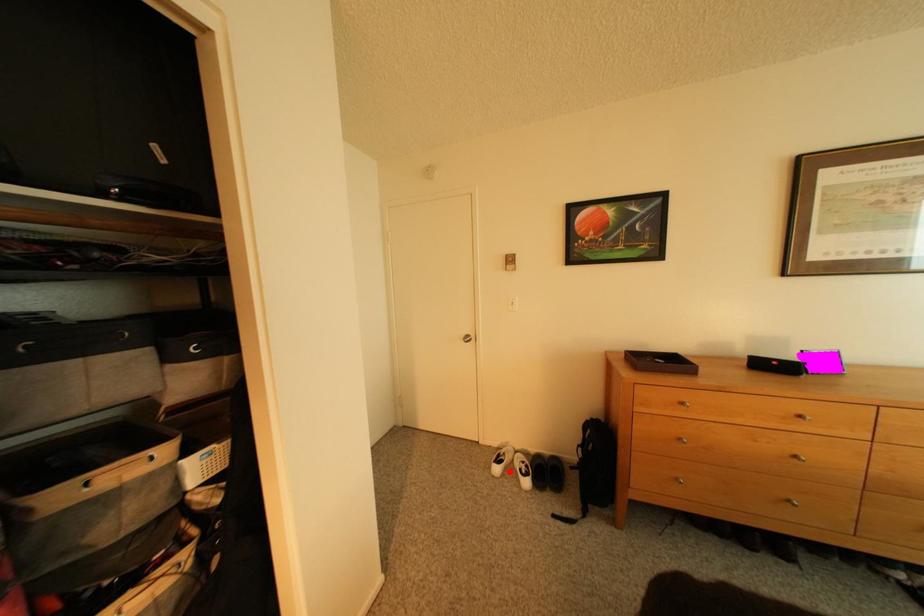
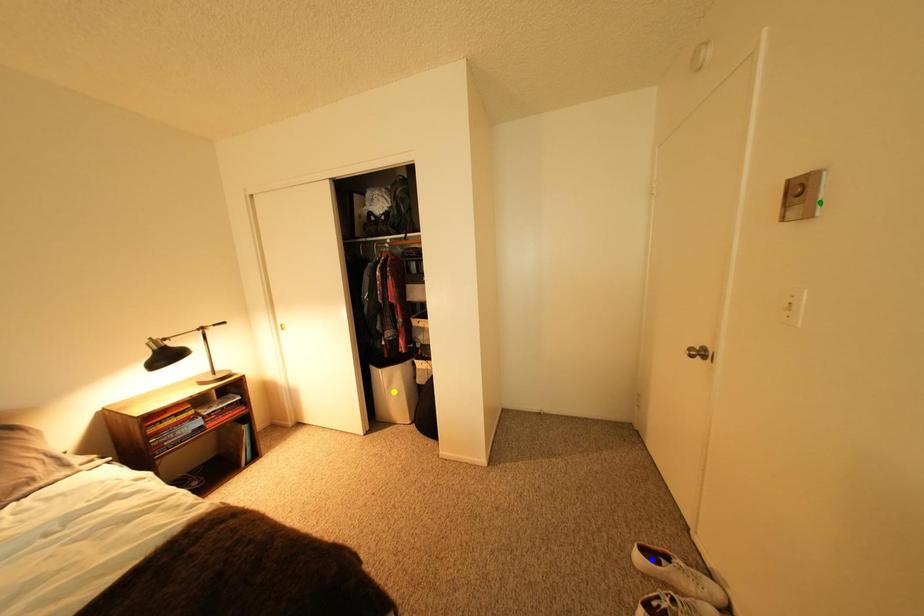
Question: I am providing you with two images of the same scene from different viewpoints. A red point is marked on the first image. You are given multiple points on the second image. Can you choose the point in image 2 that corresponds to the point in image 1?

Choices:
 (A) blue point
 (B) green point
 (C) yellow point

Answer: (A)